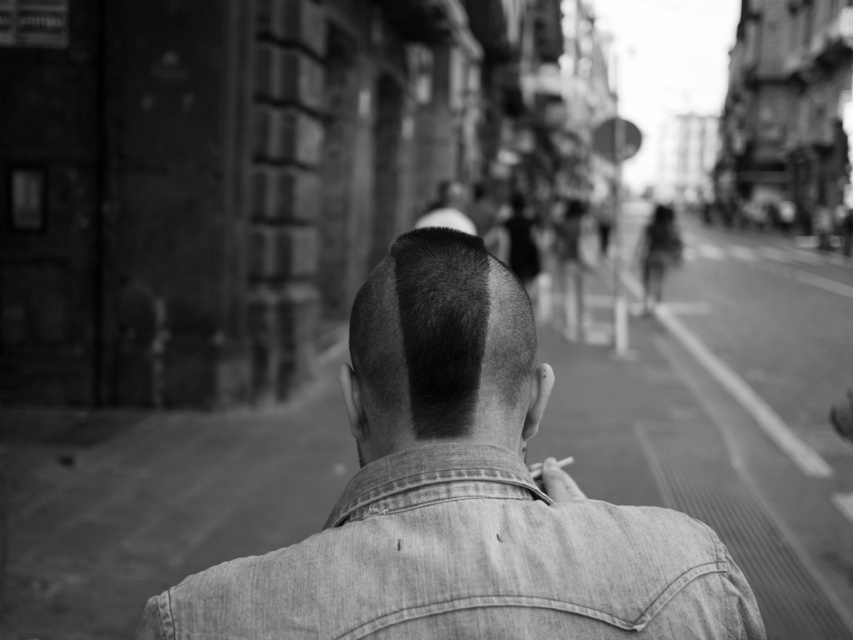
Question: From the image, what is the correct spatial relationship of faded denim jacket at lower right in relation to short hair at center?

Choices:
 (A) above
 (B) below

Answer: (B)

Question: Considering the real-world distances, which object is farthest from the faded denim jacket at lower right?

Choices:
 (A) denim jacket at center
 (B) short hair at center

Answer: (B)

Question: Is denim jacket at center smaller than faded denim jacket at lower right?

Choices:
 (A) yes
 (B) no

Answer: (B)

Question: Estimate the real-world distances between objects in this image. Which object is farther from the denim jacket at center?

Choices:
 (A) faded denim jacket at lower right
 (B) short hair at center

Answer: (B)

Question: Is denim jacket at center positioned at the back of short hair at center?

Choices:
 (A) yes
 (B) no

Answer: (B)

Question: Among these points, which one is farthest from the camera?

Choices:
 (A) (368, 403)
 (B) (439, 291)
 (C) (647, 596)

Answer: (A)